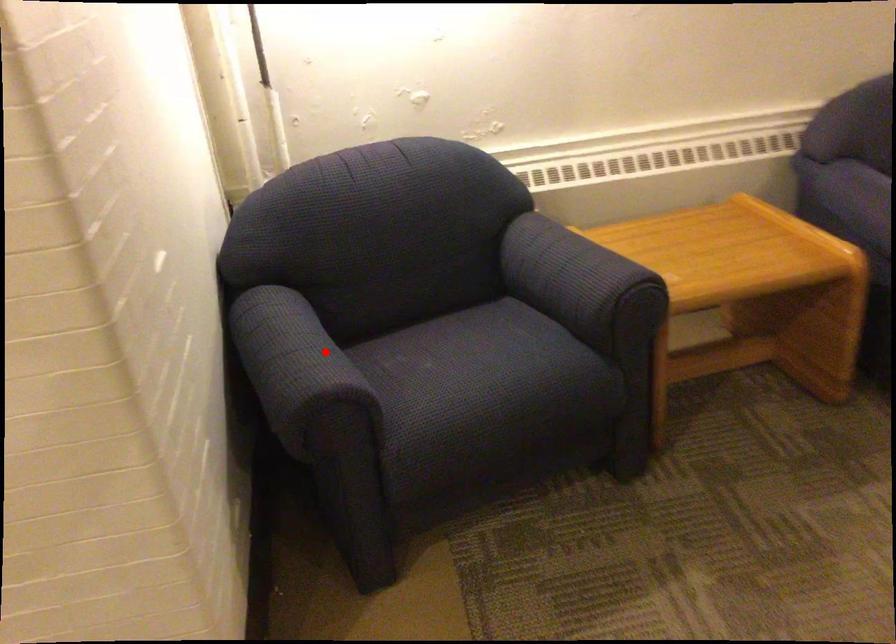
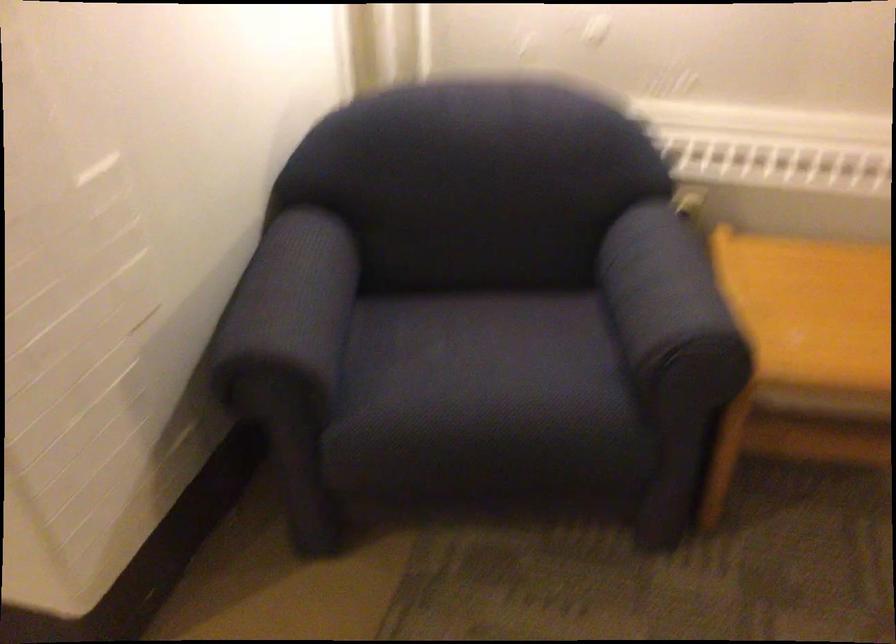
Question: A red point is marked in image1. In image2, is the corresponding 3D point closer to the camera or farther? Reply with the corresponding letter.

Choices:
 (A) The corresponding 3D point is closer.
 (B) The corresponding 3D point is farther.

Answer: (A)